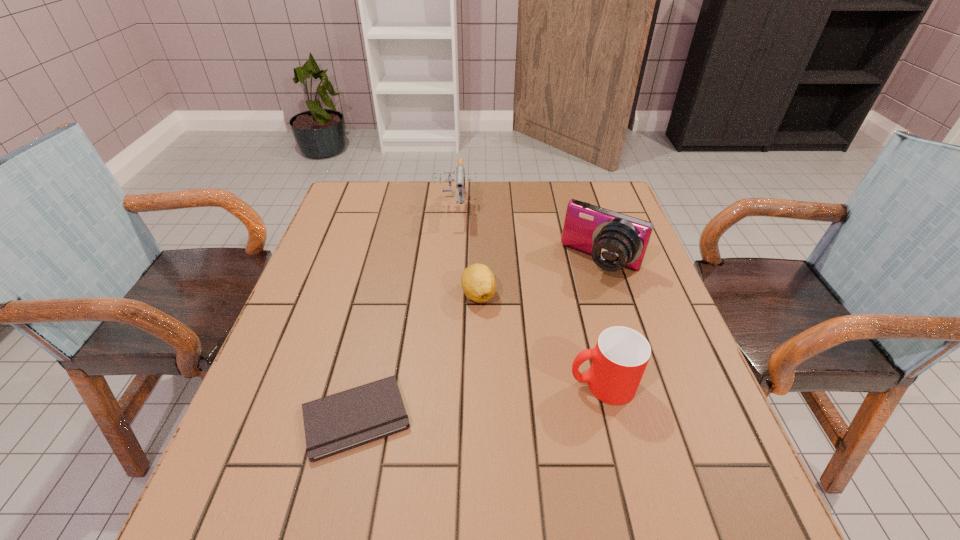
The image size is (960, 540). I want to click on object that is the closest to the camera, so click(x=478, y=283).

The image size is (960, 540). I want to click on object that is the second closest one to the shortest object, so click(619, 359).

Find the location of a particular element. This screenshot has height=540, width=960. blank space that satisfies the following two spatial constraints: 1. on the front side of the cup; 2. on the side of the farthest object with the handle is located at coordinates (444, 385).

Locate an element on the screen. The height and width of the screenshot is (540, 960). free spot that satisfies the following two spatial constraints: 1. on the front side of the gun; 2. on the side of the cup with the handle is located at coordinates (444, 385).